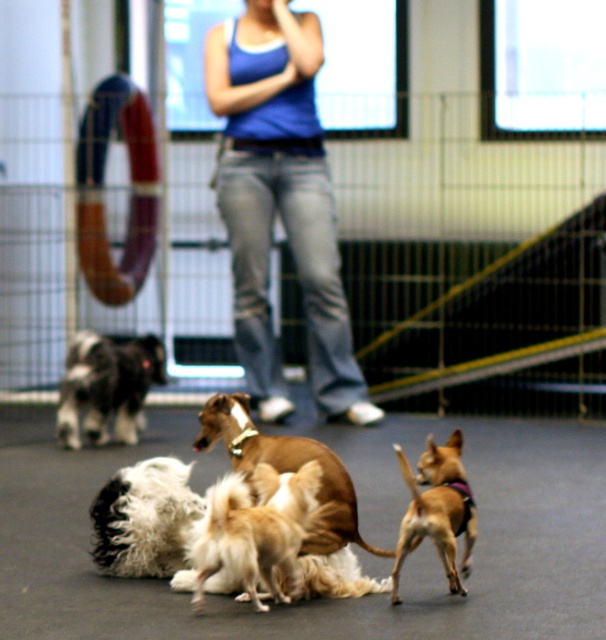
You are standing at the origin point of the coordinate system in this dog training facility. You need to locate the brown fur dog at center. What are its coordinates?

The coordinates of the brown fur dog at center are at point (288, 468).

You are a dog trainer observing the dogs in the training facility. You notice the brown fur dog at center and the golden fur dog at center. Which of these two dogs is taller?

The brown fur dog at center is taller than the golden fur dog at center.

You are a dog trainer standing at the camera position. You need to reach the brown fur dog at center as quickly as possible. What should you do?

The brown fur dog at center is 6.71 meters away from you, so you should walk straight towards it since it is the closest dog to your position.